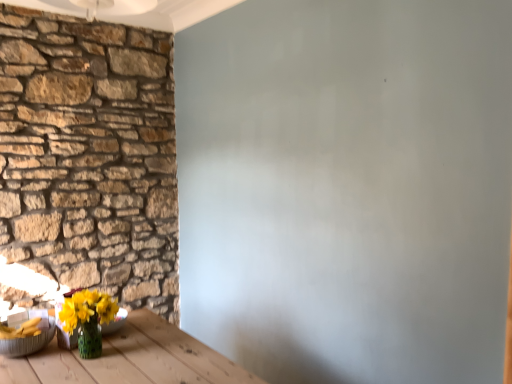
Question: Is metallic silver bowl at lower left, which is the second bowl in right-to-left order, not within translucent glass vase at lower left, which appears as the 2th bowl when viewed from the left?

Choices:
 (A) no
 (B) yes

Answer: (B)

Question: Can you confirm if metallic silver bowl at lower left, the first bowl from the left, is smaller than translucent glass vase at lower left, positioned as the 1th bowl in right-to-left order?

Choices:
 (A) yes
 (B) no

Answer: (B)

Question: Is the surface of metallic silver bowl at lower left, which is the second bowl in right-to-left order, in direct contact with translucent glass vase at lower left, which appears as the 2th bowl when viewed from the left?

Choices:
 (A) no
 (B) yes

Answer: (A)

Question: Does metallic silver bowl at lower left, which is the second bowl in right-to-left order, have a greater height compared to translucent glass vase at lower left, which appears as the 2th bowl when viewed from the left?

Choices:
 (A) no
 (B) yes

Answer: (B)

Question: Could you tell me if metallic silver bowl at lower left, which is the second bowl in right-to-left order, is facing translucent glass vase at lower left, which appears as the 2th bowl when viewed from the left?

Choices:
 (A) no
 (B) yes

Answer: (A)

Question: From a real-world perspective, is metallic silver bowl at lower left, which is the second bowl in right-to-left order, positioned under translucent glass vase at lower left, positioned as the 1th bowl in right-to-left order, based on gravity?

Choices:
 (A) yes
 (B) no

Answer: (B)

Question: Considering the relative sizes of natural stone wall at left and metallic silver bowl at lower left, which is the second bowl in right-to-left order, in the image provided, is natural stone wall at left bigger than metallic silver bowl at lower left, which is the second bowl in right-to-left order,?

Choices:
 (A) yes
 (B) no

Answer: (A)

Question: From a real-world perspective, is natural stone wall at left located beneath metallic silver bowl at lower left, the first bowl from the left?

Choices:
 (A) yes
 (B) no

Answer: (B)

Question: Could you tell me if natural stone wall at left is turned towards metallic silver bowl at lower left, the first bowl from the left?

Choices:
 (A) yes
 (B) no

Answer: (A)

Question: Can you confirm if natural stone wall at left is positioned to the left of metallic silver bowl at lower left, which is the second bowl in right-to-left order?

Choices:
 (A) yes
 (B) no

Answer: (A)

Question: Is natural stone wall at left closer to the viewer compared to metallic silver bowl at lower left, the first bowl from the left?

Choices:
 (A) yes
 (B) no

Answer: (B)

Question: Is natural stone wall at left oriented away from metallic silver bowl at lower left, which is the second bowl in right-to-left order?

Choices:
 (A) no
 (B) yes

Answer: (A)

Question: Does translucent glass vase at lower left, positioned as the 1th bowl in right-to-left order, have a larger size compared to natural stone wall at left?

Choices:
 (A) no
 (B) yes

Answer: (A)